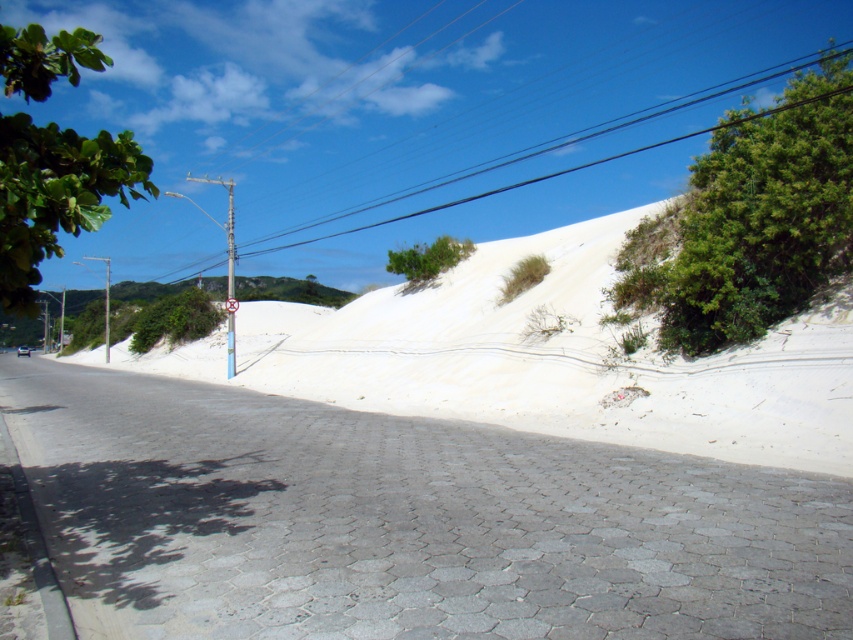
Question: Which object appears farthest from the camera in this image?

Choices:
 (A) green leafy bush at center
 (B) white plastic sign at upper center
 (C) blue painted metal pole at center

Answer: (A)

Question: Which point is farther to the camera?

Choices:
 (A) white plastic sign at upper center
 (B) green leafy tree at left
 (C) green leafy bush at upper center
 (D) green leafy bush at center

Answer: (D)

Question: Is white sand dune at center smaller than green leafy bush at upper right?

Choices:
 (A) no
 (B) yes

Answer: (A)

Question: Is green leafy bush at center smaller than white plastic sign at upper center?

Choices:
 (A) no
 (B) yes

Answer: (A)

Question: Can you confirm if green leafy bush at center is positioned below green leafy bush at upper center?

Choices:
 (A) yes
 (B) no

Answer: (A)

Question: Which point is farther from the camera taking this photo?

Choices:
 (A) (846, 244)
 (B) (144, 170)

Answer: (A)